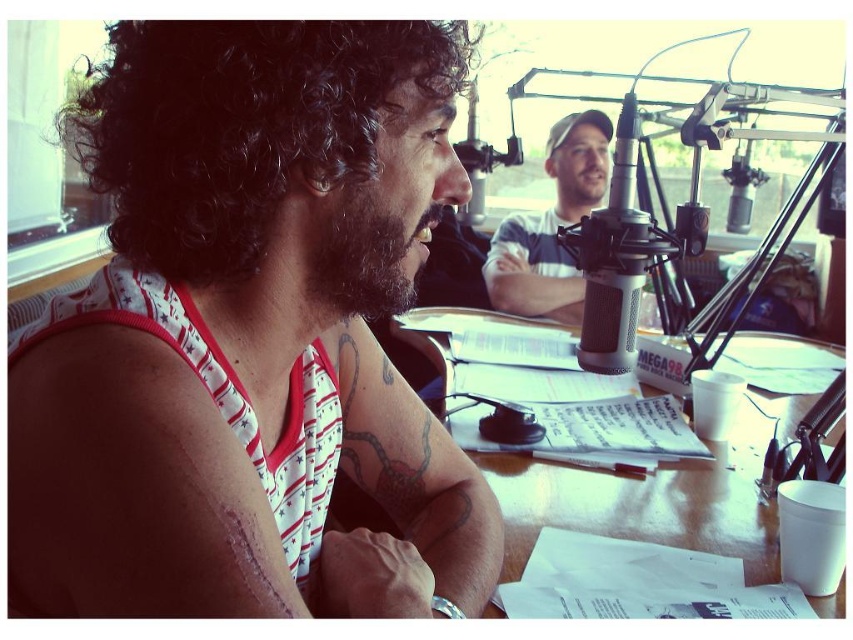
Question: Which point is closer to the camera taking this photo?

Choices:
 (A) (155, 371)
 (B) (547, 300)
 (C) (511, 504)
 (D) (468, 54)

Answer: (A)

Question: From the image, what is the correct spatial relationship of wooden table at center in relation to white striped shirt at center?

Choices:
 (A) above
 (B) below

Answer: (B)

Question: Can you confirm if white striped tank top at left is positioned to the right of scar tissue at upper left?

Choices:
 (A) no
 (B) yes

Answer: (B)

Question: Among these objects, which one is nearest to the camera?

Choices:
 (A) white striped tank top at left
 (B) scar tissue at upper left
 (C) white striped shirt at center
 (D) wooden table at center

Answer: (A)

Question: Can you confirm if wooden table at center is wider than white striped shirt at center?

Choices:
 (A) yes
 (B) no

Answer: (A)

Question: Which object is the farthest from the white striped tank top at left?

Choices:
 (A) white striped shirt at center
 (B) scar tissue at upper left
 (C) wooden table at center

Answer: (A)